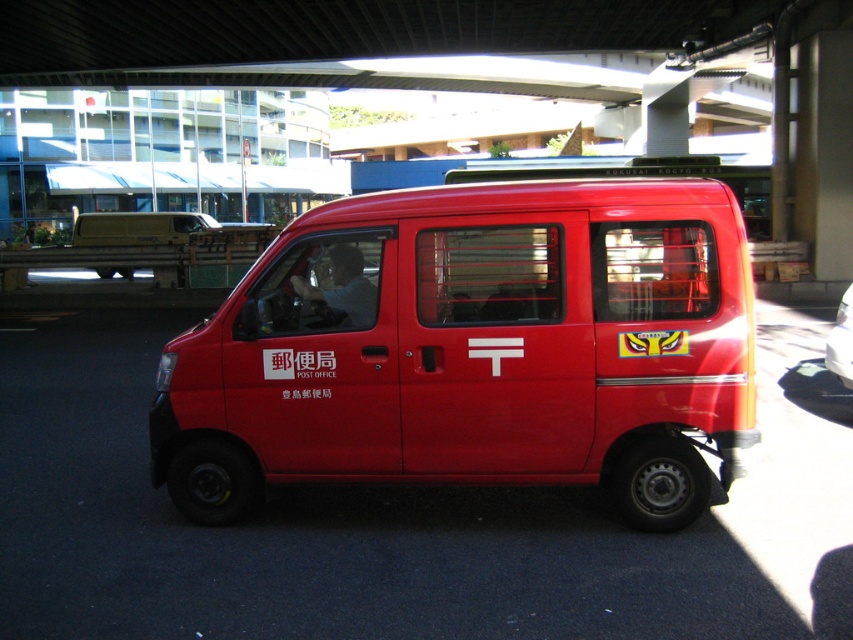
Question: Is matte red van at center wider than matte yellow van at left?

Choices:
 (A) yes
 (B) no

Answer: (B)

Question: Among these objects, which one is nearest to the camera?

Choices:
 (A) matte red van at center
 (B) matte yellow van at left
 (C) metallic red van at center

Answer: (A)

Question: Can you confirm if matte red van at center is smaller than metallic red van at center?

Choices:
 (A) yes
 (B) no

Answer: (A)

Question: Which object appears closest to the camera in this image?

Choices:
 (A) matte red van at center
 (B) metallic red van at center
 (C) matte yellow van at left

Answer: (A)

Question: From the image, what is the correct spatial relationship of matte red van at center in relation to matte yellow van at left?

Choices:
 (A) above
 (B) below

Answer: (B)

Question: Which is farther from the matte yellow van at left?

Choices:
 (A) metallic red van at center
 (B) matte red van at center

Answer: (A)